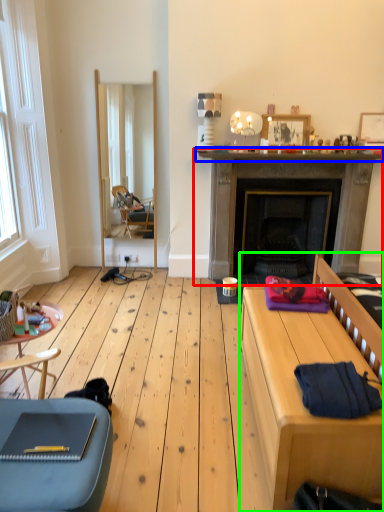
Question: Which object is the farthest from fireplace (highlighted by a red box)? Choose among these: mantle (highlighted by a blue box) or bed frame (highlighted by a green box).

Choices:
 (A) mantle
 (B) bed frame

Answer: (B)